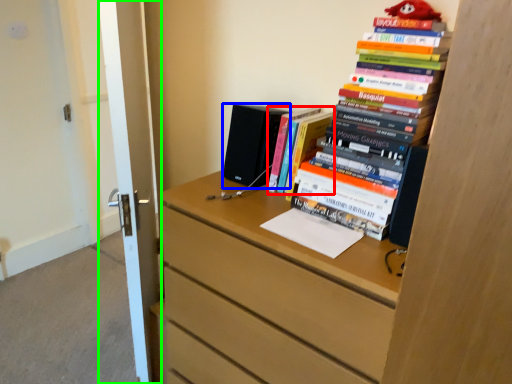
Question: Estimate the real-world distances between objects in this image. Which object is closer to book (highlighted by a red box), speaker (highlighted by a blue box) or door (highlighted by a green box)?

Choices:
 (A) speaker
 (B) door

Answer: (A)